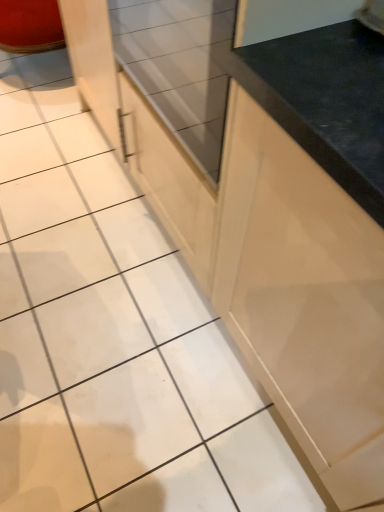
Describe the element at coordinates (300, 285) in the screenshot. I see `matte wood drawer at center` at that location.

This screenshot has height=512, width=384. I want to click on matte wood drawer at center, so click(300, 285).

In order to click on matte wood drawer at center in this screenshot , I will do `click(300, 285)`.